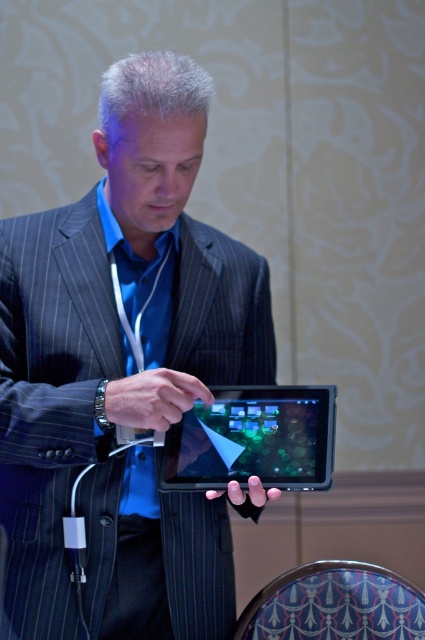
Locate an element on the screen. The width and height of the screenshot is (425, 640). matte black suit at center is located at coordinates (124, 372).

Does point (167, 372) come in front of point (289, 486)?

Yes, it is in front of point (289, 486).

In order to click on matte black suit at center in this screenshot , I will do `click(124, 372)`.